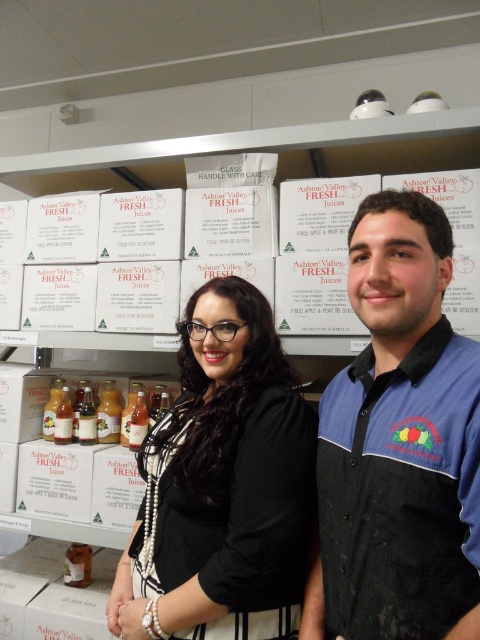
You are a store manager who needs to ensure that the two employees are maintaining the required 10 feet of social distancing. Based on the image, can you determine if the blue fabric shirt at center and the black matte blouse at center are within the safe distance?

The blue fabric shirt at center is 8.75 inches away from the black matte blouse at center, which is much less than the required 10 feet. Therefore, they are not maintaining the safe distance.

You are a customer trying to reach a product on a high shelf. You see the blue fabric shirt at center and the black matte blouse at center. Which one should you ask for help?

The blue fabric shirt at center is much taller than the black matte blouse at center, so you should ask the person wearing the blue fabric shirt at center for help.